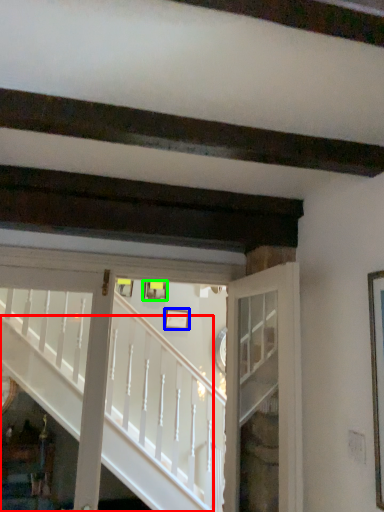
Question: Considering the real-world distances, which object is farthest from stairs (highlighted by a red box)? picture frame (highlighted by a blue box) or picture frame (highlighted by a green box)?

Choices:
 (A) picture frame
 (B) picture frame

Answer: (A)